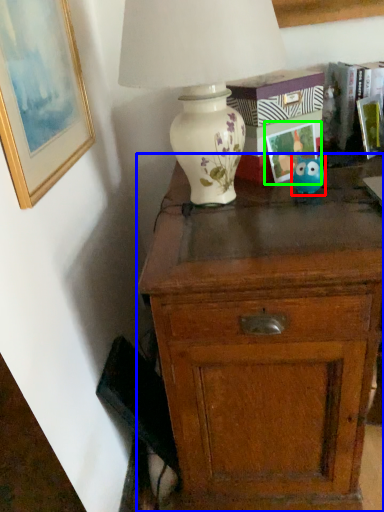
Question: Estimate the real-world distances between objects in this image. Which object is farther from toy (highlighted by a red box), chest of drawers (highlighted by a blue box) or picture frame (highlighted by a green box)?

Choices:
 (A) chest of drawers
 (B) picture frame

Answer: (A)